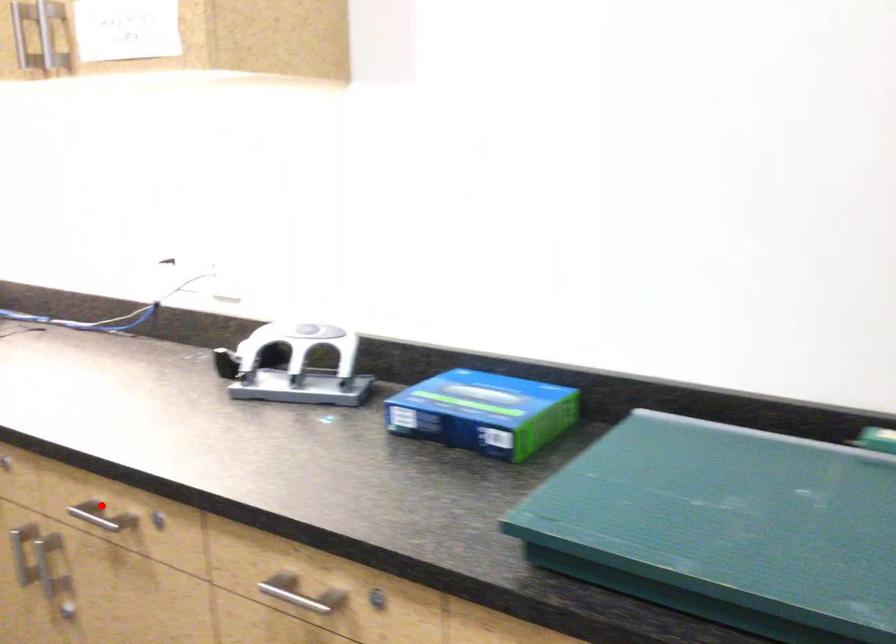
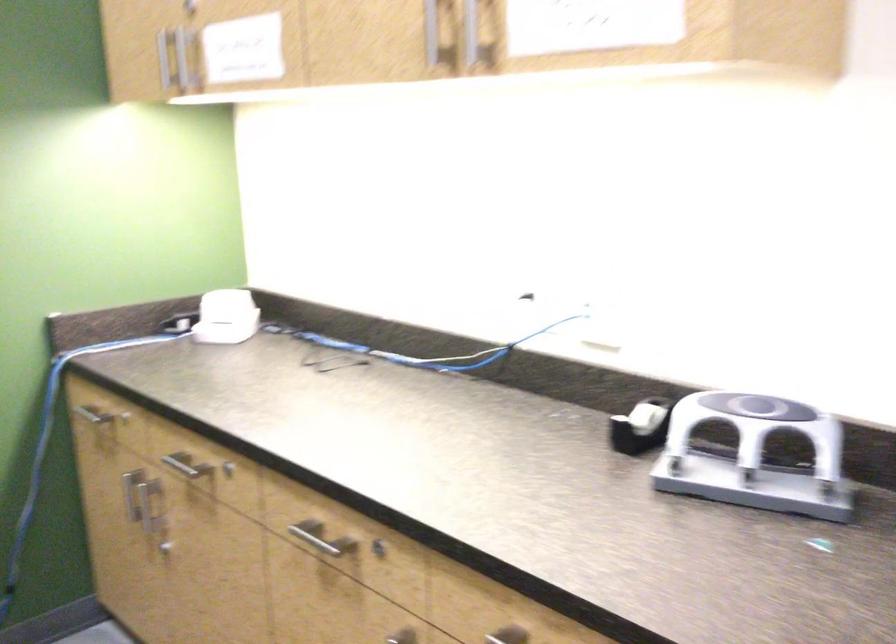
Question: I am providing you with two images of the same scene from different viewpoints. In image1, a red point is highlighted. Considering the same 3D point in image2, which of the following is correct?

Choices:
 (A) It is closer
 (B) It is farther

Answer: (A)